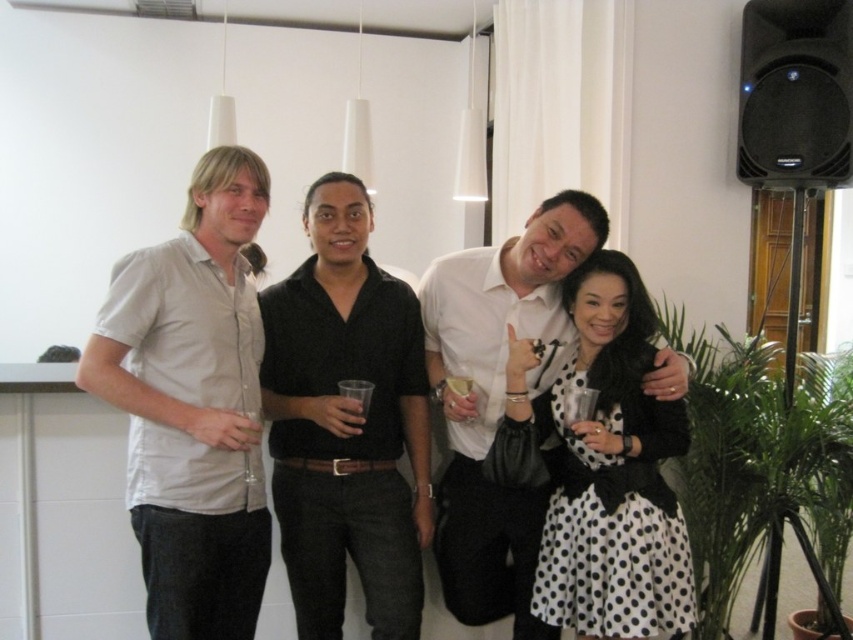
Question: Among these objects, which one is farthest from the camera?

Choices:
 (A) black smooth shirt at center
 (B) light gray cotton shirt at left
 (C) transparent plastic cup at center

Answer: (A)

Question: Which object appears closest to the camera in this image?

Choices:
 (A) light gray cotton shirt at left
 (B) transparent plastic cup at center

Answer: (A)

Question: Which point is farther to the camera?

Choices:
 (A) light gray cotton shirt at left
 (B) black plastic speaker at upper right

Answer: (B)

Question: Can you confirm if black smooth shirt at center is wider than white opaque glass at center?

Choices:
 (A) yes
 (B) no

Answer: (A)

Question: Does transparent plastic cup at center come in front of translucent plastic cup at center?

Choices:
 (A) no
 (B) yes

Answer: (B)

Question: Does white dotted dress at center have a larger size compared to white opaque glass at center?

Choices:
 (A) yes
 (B) no

Answer: (A)